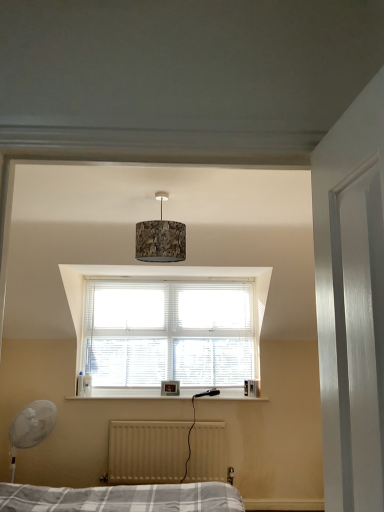
At what (x,y) coordinates should I click in order to perform the action: click on free space above white matte radiator at lower center (from a real-world perspective). Please return your answer as a coordinate pair (x, y). Looking at the image, I should click on (168, 418).